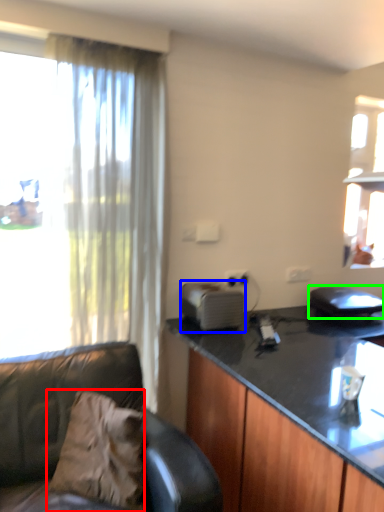
Question: Which object is positioned farthest from pillow (highlighted by a red box)? Select from appliance (highlighted by a blue box) and appliance (highlighted by a green box).

Choices:
 (A) appliance
 (B) appliance

Answer: (B)